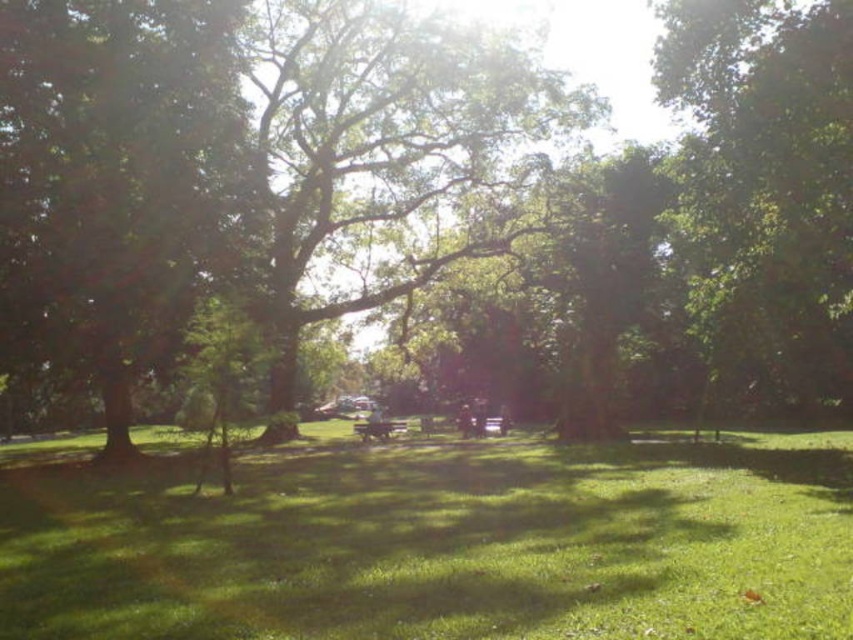
In the scene shown: Between green grassy field at center and wooden park bench at center, which one is positioned lower?

wooden park bench at center

Which is above, green grassy field at center or wooden park bench at center?

green grassy field at center

Find the location of `green grassy field at center`. green grassy field at center is located at coordinates pos(434,540).

Identify the location of green grassy field at center. The height and width of the screenshot is (640, 853). (434, 540).

Which is below, green leafy tree at center or wooden park bench at center?

wooden park bench at center is below.

Is point (271, 417) positioned after point (398, 428)?

No.

Find the location of a particular element. The width and height of the screenshot is (853, 640). green leafy tree at center is located at coordinates (422, 198).

Based on the photo, is green leafy tree at center bigger than green grassy field at center?

Yes.

Is green leafy tree at center thinner than green grassy field at center?

No.

Is point (744, 84) closer to camera compared to point (613, 580)?

That is False.

Locate an element on the screen. This screenshot has width=853, height=640. green leafy tree at center is located at coordinates (422, 198).